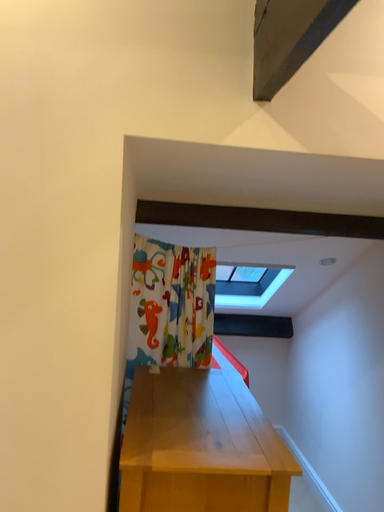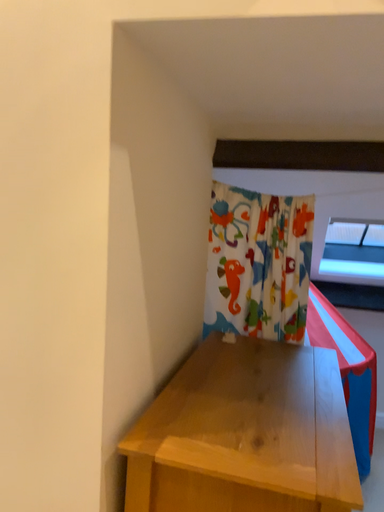
Question: Which way did the camera rotate in the video?

Choices:
 (A) rotated left
 (B) rotated right

Answer: (A)